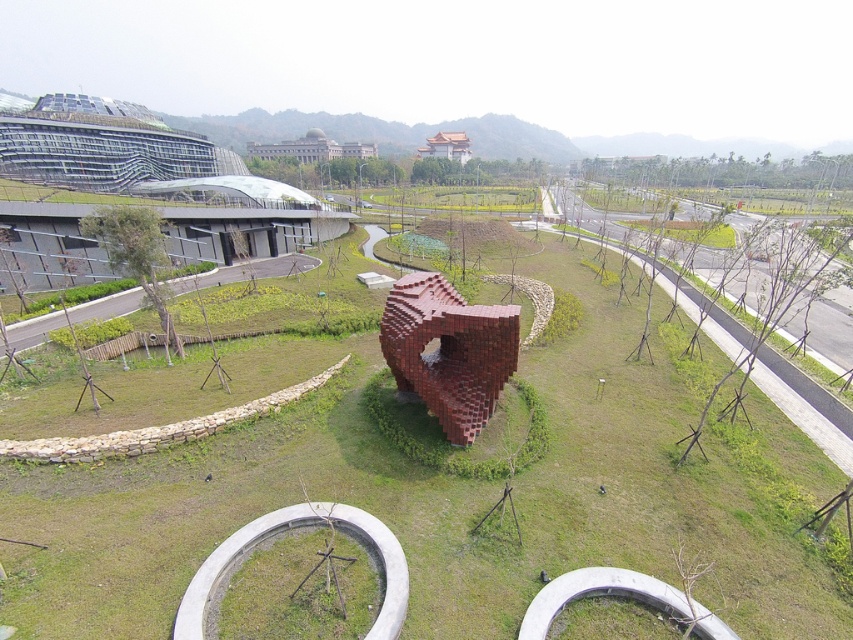
Question: Considering the relative positions of green grassy at center and brick heart at center in the image provided, where is green grassy at center located with respect to brick heart at center?

Choices:
 (A) above
 (B) below

Answer: (B)

Question: Is green grassy at center below brick heart at center?

Choices:
 (A) no
 (B) yes

Answer: (B)

Question: Does green grassy at center have a greater width compared to brick heart at center?

Choices:
 (A) yes
 (B) no

Answer: (A)

Question: Which of the following is the closest to the observer?

Choices:
 (A) green grassy at center
 (B) brick heart at center

Answer: (A)

Question: Which of the following is the farthest from the observer?

Choices:
 (A) (67, 516)
 (B) (462, 336)

Answer: (B)